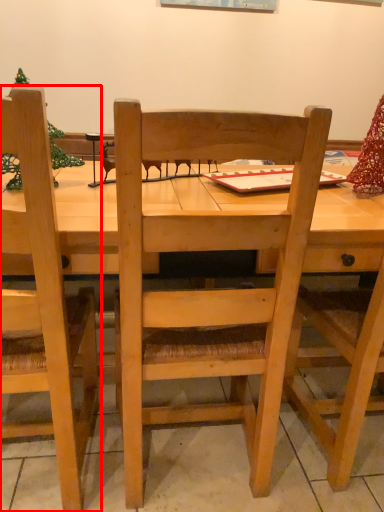
Question: From the image's perspective, considering the relative positions of chair (annotated by the red box) and chair in the image provided, where is chair (annotated by the red box) located with respect to the staircase?

Choices:
 (A) above
 (B) below

Answer: (B)